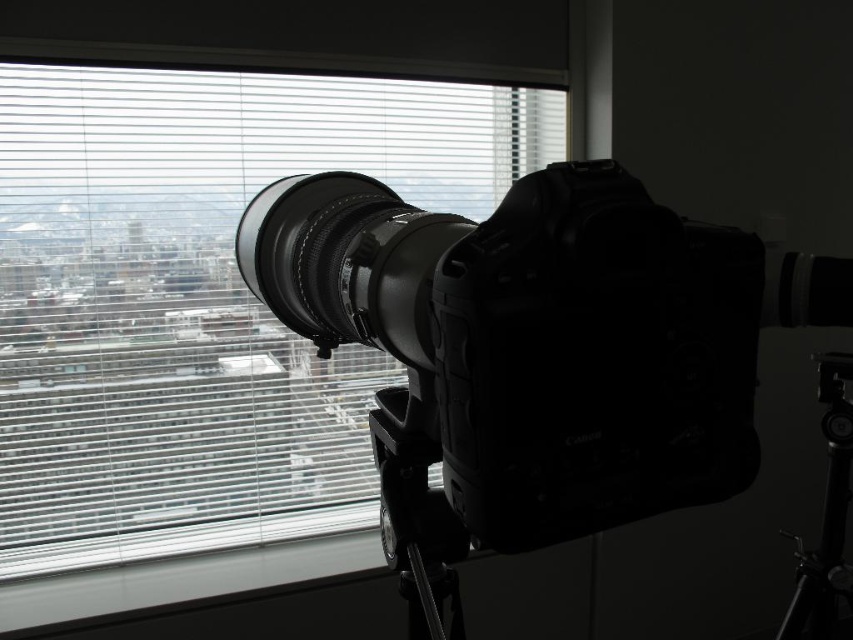
Question: Can you confirm if white matte blinds at upper center is positioned to the right of black rubber lens at center?

Choices:
 (A) yes
 (B) no

Answer: (B)

Question: Which object is closer to the camera taking this photo?

Choices:
 (A) white matte blinds at upper center
 (B) black matte camera at center
 (C) black rubber lens at center
 (D) black metal tripod at lower right

Answer: (B)

Question: Observing the image, what is the correct spatial positioning of black matte camera at center in reference to black metal tripod at lower right?

Choices:
 (A) left
 (B) right

Answer: (A)

Question: Which of the following is the farthest from the observer?

Choices:
 (A) click(274, 499)
 (B) click(843, 449)
 (C) click(374, 340)
 (D) click(344, 218)

Answer: (A)

Question: Which object is positioned farthest from the black matte camera at center?

Choices:
 (A) black rubber lens at center
 (B) white matte blinds at upper center
 (C) black metal tripod at lower right

Answer: (B)

Question: Is white matte blinds at upper center wider than black rubber lens at center?

Choices:
 (A) yes
 (B) no

Answer: (A)